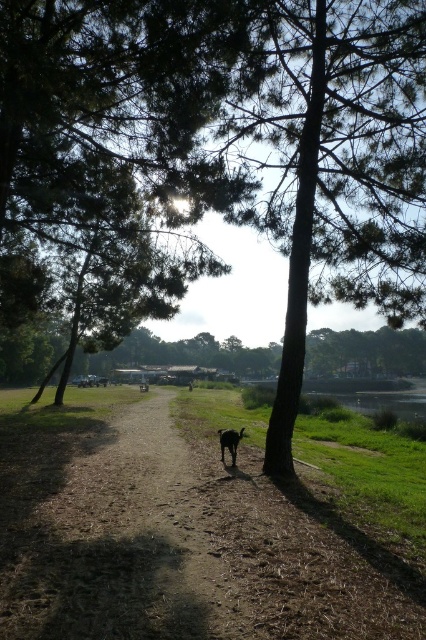
Question: Is green leafy tree at center above black fur dog at center?

Choices:
 (A) no
 (B) yes

Answer: (B)

Question: Which point is closer to the camera taking this photo?

Choices:
 (A) (233, 465)
 (B) (210, 556)
 (C) (58, 60)

Answer: (B)

Question: Does green leafy tree at center appear on the right side of black fur dog at center?

Choices:
 (A) yes
 (B) no

Answer: (B)

Question: Among these points, which one is farthest from the camera?

Choices:
 (A) (92, 294)
 (B) (230, 456)
 (C) (129, 520)

Answer: (A)

Question: Which point is farther to the camera?

Choices:
 (A) brown dirt path at center
 (B) green leafy tree at center
 (C) black fur dog at center

Answer: (C)

Question: Is the position of brown dirt path at center less distant than that of black fur dog at center?

Choices:
 (A) yes
 (B) no

Answer: (A)